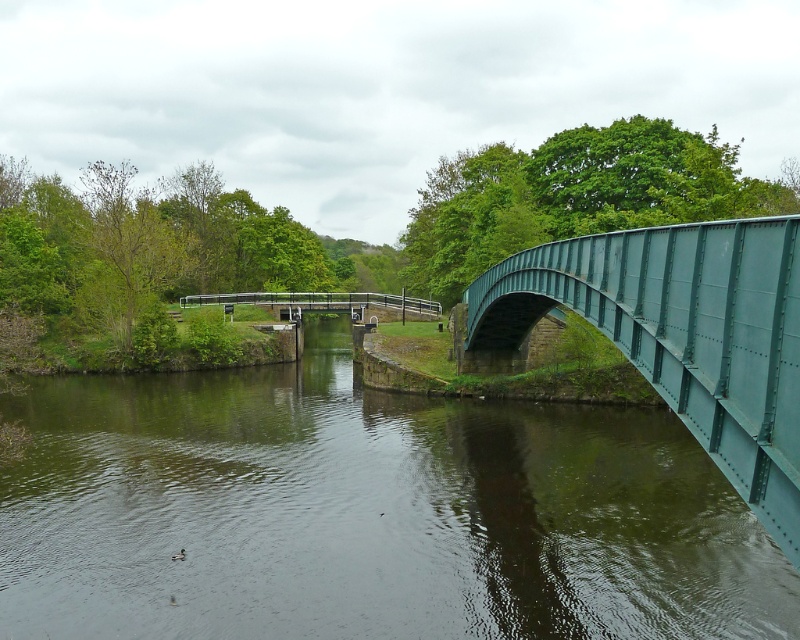
Question: Does green metallic river at center appear on the left side of green metallic pedestrian bridge at center?

Choices:
 (A) no
 (B) yes

Answer: (A)

Question: Which object is positioned closest to the green metallic pedestrian bridge at center?

Choices:
 (A) green metallic bridge at right
 (B) green metallic river at center

Answer: (B)

Question: Based on their relative distances, which object is nearer to the green metallic bridge at right?

Choices:
 (A) green metallic river at center
 (B) green metallic pedestrian bridge at center

Answer: (A)

Question: Is green metallic bridge at right smaller than green metallic pedestrian bridge at center?

Choices:
 (A) no
 (B) yes

Answer: (B)

Question: Is green metallic river at center smaller than green metallic bridge at right?

Choices:
 (A) yes
 (B) no

Answer: (B)

Question: Among these points, which one is farthest from the camera?

Choices:
 (A) (284, 296)
 (B) (500, 529)

Answer: (A)